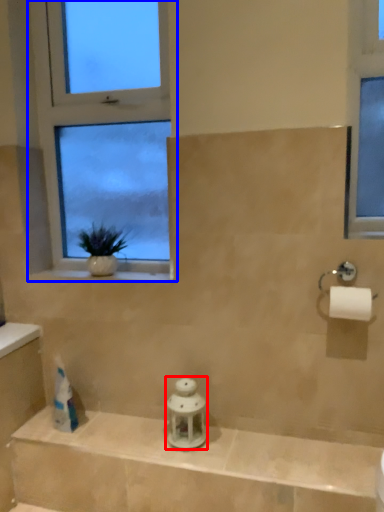
Question: Which point is further to the camera, toiletry (highlighted by a red box) or window (highlighted by a blue box)?

Choices:
 (A) toiletry
 (B) window

Answer: (B)